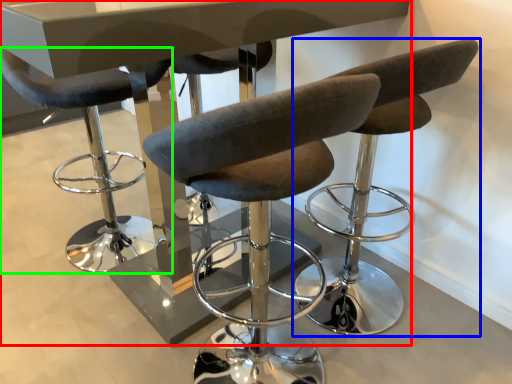
Question: Based on their relative distances, which object is farther from table (highlighted by a red box)? Choose from chair (highlighted by a blue box) and chair (highlighted by a green box).

Choices:
 (A) chair
 (B) chair

Answer: (B)